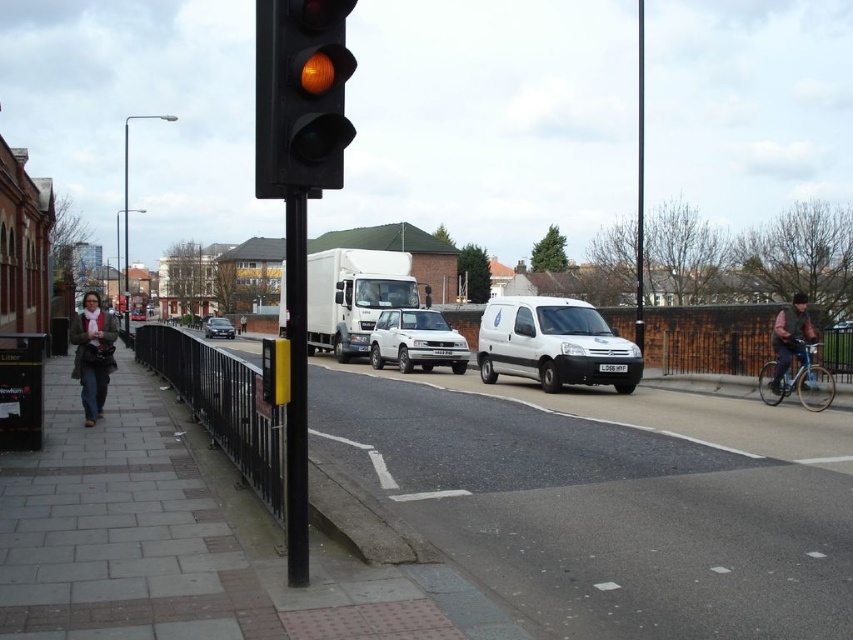
Can you confirm if matte black traffic light at upper center is positioned to the left of black/yellow-painted metal pole at left?

No, matte black traffic light at upper center is not to the left of black/yellow-painted metal pole at left.

Is point (305, 35) in front of point (293, 554)?

Yes, it is.

This screenshot has height=640, width=853. In order to click on matte black traffic light at upper center in this screenshot , I will do `click(300, 96)`.

Does point (71, 417) lie in front of point (325, 60)?

No, it is not.

Between point (103, 515) and point (310, 29), which one is positioned behind?

The point (103, 515) is more distant.

Locate an element on the screen. Image resolution: width=853 pixels, height=640 pixels. gray concrete sidewalk at lower left is located at coordinates (170, 538).

You are a GUI agent. You are given a task and a screenshot of the screen. Output one action in this format:
    pyautogui.click(x=<x>, y=<y>)
    Task: Click on the gray concrete sidewalk at lower left
    The height and width of the screenshot is (640, 853).
    Given the screenshot: What is the action you would take?
    pyautogui.click(x=170, y=538)

Is point (233, 570) more distant than point (808, 333)?

No, (233, 570) is closer to viewer.

Is gray concrete sidewalk at lower left below dark brown leather jacket at right?

Correct, gray concrete sidewalk at lower left is located below dark brown leather jacket at right.

Who is more distant from viewer, (212, 512) or (778, 371)?

The point (778, 371) is behind.

The image size is (853, 640). I want to click on gray concrete sidewalk at lower left, so click(x=170, y=538).